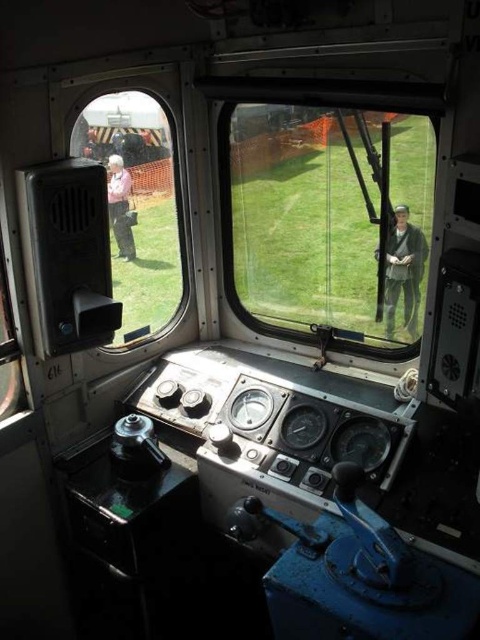
You are a passenger in the train cab and want to look outside through the windows. Which window, the clear glass window at center or the clear glass window at left, allows you to see a wider view horizontally?

The clear glass window at center allows a wider horizontal view because its width surpasses that of the clear glass window at left.

You are an engineer in the train cab. You notice two points on the control panel. The first point is at coordinates point (348, 296) and the second is at point (136, 282). From your perspective inside the cab, which point is closer to the front window?

Point (348, 296) is in front of point (136, 282), so it is closer to the front window.

You are inside the train cab and want to look through the clear glass window at center. Where exactly should you look to see the point located at coordinates (327, 220)?

The point at coordinates (327, 220) is on the clear glass window at center, so you should look directly at the center of the clear glass window at center to see it.